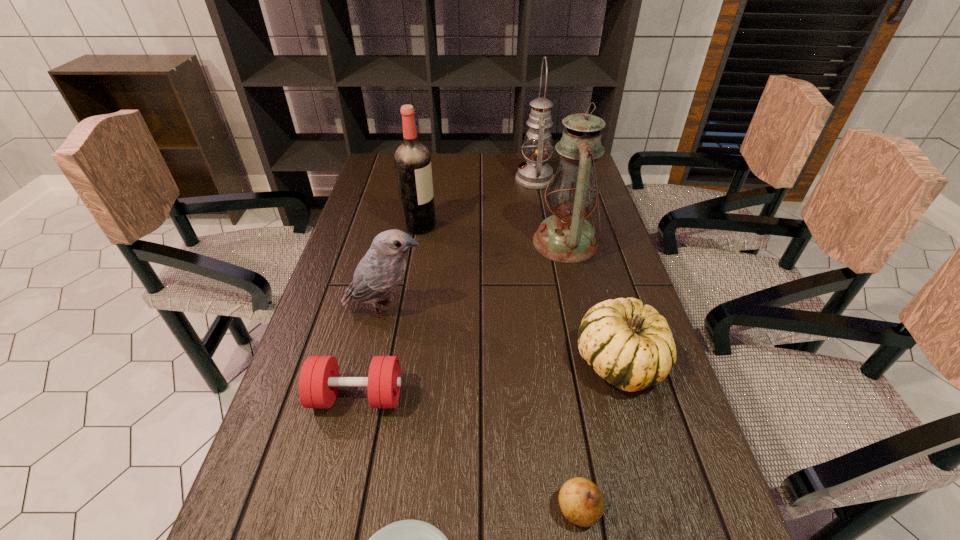
You are a GUI agent. You are given a task and a screenshot of the screen. Output one action in this format:
    pyautogui.click(x=<x>, y=<y>)
    Task: Click on the farthest object
    The height and width of the screenshot is (540, 960).
    Given the screenshot: What is the action you would take?
    pyautogui.click(x=534, y=174)

This screenshot has width=960, height=540. In order to click on the nearer oil lamp in this screenshot , I will do `click(566, 236)`.

Identify the location of liquor. The image size is (960, 540). (412, 159).

This screenshot has height=540, width=960. I want to click on parrot, so click(378, 273).

Where is `the fifth nearest object`? the fifth nearest object is located at coordinates (378, 273).

You are a GUI agent. You are given a task and a screenshot of the screen. Output one action in this format:
    pyautogui.click(x=<x>, y=<y>)
    Task: Click on the fifth tallest object
    The image size is (960, 540).
    Given the screenshot: What is the action you would take?
    pyautogui.click(x=630, y=345)

You are a GUI agent. You are given a task and a screenshot of the screen. Output one action in this format:
    pyautogui.click(x=<x>, y=<y>)
    Task: Click on the dumbbell
    Image resolution: width=960 pixels, height=540 pixels.
    Given the screenshot: What is the action you would take?
    pyautogui.click(x=319, y=380)

At what (x,y) coordinates should I click in order to perform the action: click on pear. Please return your answer as a coordinate pair (x, y). Looking at the image, I should click on (581, 501).

This screenshot has height=540, width=960. What are the coordinates of `blank space located 0.110m on the front of the farther oil lamp` in the screenshot? It's located at (540, 210).

At what (x,y) coordinates should I click in order to perform the action: click on free space located on the left of the nearer oil lamp. Please return your answer as a coordinate pair (x, y). Image resolution: width=960 pixels, height=540 pixels. Looking at the image, I should click on (420, 242).